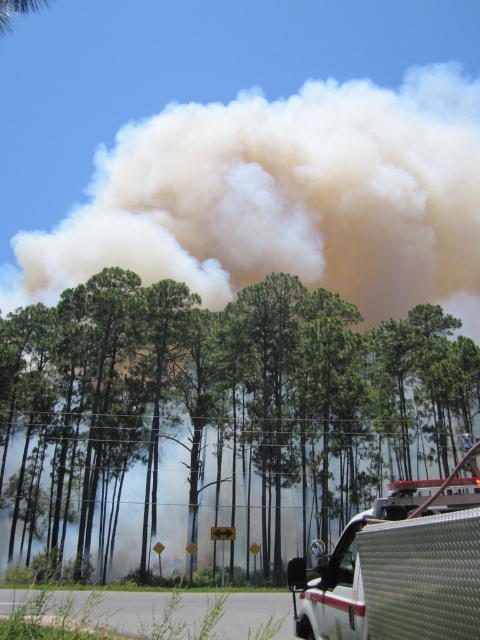
Question: Is green leafy tree at center thinner than white textured truck at lower right?

Choices:
 (A) no
 (B) yes

Answer: (A)

Question: Is green leafy tree at center to the right of white textured truck at lower right from the viewer's perspective?

Choices:
 (A) yes
 (B) no

Answer: (B)

Question: Among these points, which one is nearest to the camera?

Choices:
 (A) [x=265, y=358]
 (B) [x=422, y=496]

Answer: (B)

Question: Which object appears farthest from the camera in this image?

Choices:
 (A) white textured truck at lower right
 (B) green leafy tree at center

Answer: (B)

Question: Does green leafy tree at center have a greater width compared to white textured truck at lower right?

Choices:
 (A) yes
 (B) no

Answer: (A)